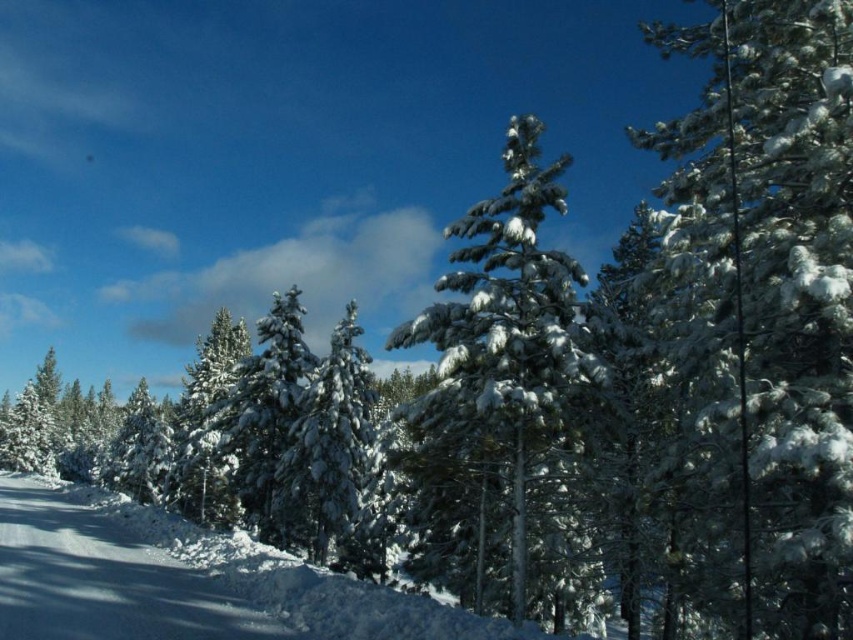
Does white snow-covered tree at center appear over green matte tree at center?

Indeed, white snow-covered tree at center is positioned over green matte tree at center.

Can you confirm if white snow-covered tree at center is taller than green matte tree at center?

Incorrect, white snow-covered tree at center's height is not larger of green matte tree at center's.

Identify the location of white snow-covered tree at center. The height and width of the screenshot is (640, 853). (326, 445).

Does white snow path at lower left appear under green matte tree at center?

Yes, white snow path at lower left is below green matte tree at center.

What do you see at coordinates (103, 579) in the screenshot? Image resolution: width=853 pixels, height=640 pixels. I see `white snow path at lower left` at bounding box center [103, 579].

This screenshot has width=853, height=640. Find the location of `white snow path at lower left`. white snow path at lower left is located at coordinates (103, 579).

Does white snow-covered tree at upper right have a greater height compared to white snow path at lower left?

Indeed, white snow-covered tree at upper right has a greater height compared to white snow path at lower left.

Can you confirm if white snow-covered tree at upper right is positioned below white snow path at lower left?

Incorrect, white snow-covered tree at upper right is not positioned below white snow path at lower left.

At what (x,y) coordinates should I click in order to perform the action: click on white snow-covered tree at upper right. Please return your answer as a coordinate pair (x, y). Image resolution: width=853 pixels, height=640 pixels. Looking at the image, I should click on (776, 285).

Locate an element on the screen. white snow-covered tree at upper right is located at coordinates (776, 285).